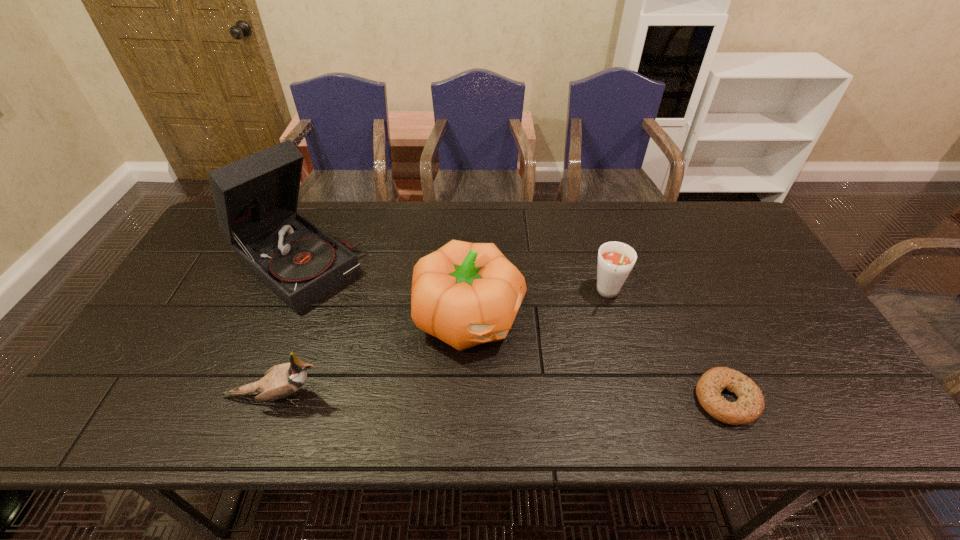
You are a GUI agent. You are given a task and a screenshot of the screen. Output one action in this format:
    pyautogui.click(x=<x>, y=<y>)
    Task: Click on the unoccupied area between the bird and the tallest object
    
    Given the screenshot: What is the action you would take?
    pyautogui.click(x=286, y=330)

Find the location of a particular element. This screenshot has height=540, width=960. empty location between the rightmost object and the bird is located at coordinates (501, 398).

Locate an element on the screen. This screenshot has width=960, height=540. vacant area between the bagel and the second tallest object is located at coordinates (598, 359).

Where is `free space between the bagel and the root beer`? The width and height of the screenshot is (960, 540). free space between the bagel and the root beer is located at coordinates (667, 347).

This screenshot has height=540, width=960. Find the location of `the fourth closest object to the third object from left to right`. the fourth closest object to the third object from left to right is located at coordinates (750, 404).

Locate which object ranks third in proximity to the tallest object. Please provide its 2D coordinates. Your answer should be formatted as a tuple, i.e. [(x, y)], where the tuple contains the x and y coordinates of a point satisfying the conditions above.

[(615, 261)]

The height and width of the screenshot is (540, 960). I want to click on vacant space that satisfies the following two spatial constraints: 1. on the front side of the rightmost object; 2. on the right side of the phonograph_record, so 237,400.

You are a GUI agent. You are given a task and a screenshot of the screen. Output one action in this format:
    pyautogui.click(x=<x>, y=<y>)
    Task: Click on the vacant space that satisfies the following two spatial constraints: 1. on the front side of the pumpkin; 2. on the left side of the tallest object
    The width and height of the screenshot is (960, 540).
    Given the screenshot: What is the action you would take?
    pyautogui.click(x=273, y=318)

In order to click on free region that satisfies the following two spatial constraints: 1. on the back side of the fourth object from left to right; 2. on the right side of the pumpkin in this screenshot , I will do `click(469, 294)`.